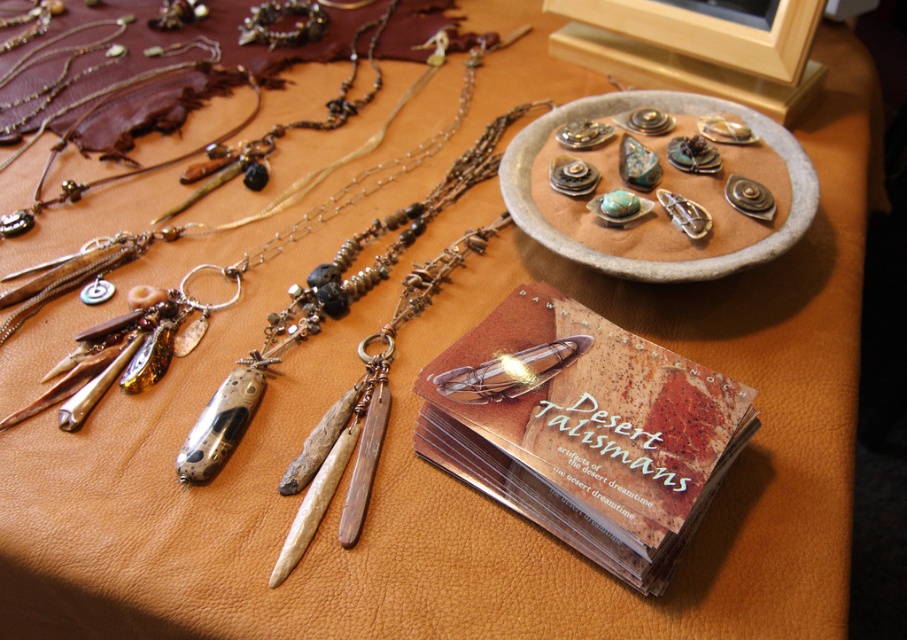
From the picture: You are standing in front of the jewelry display and want to pick up an item. There are two points marked in the image. Which point is closer to you, point (276, 349) or point (680, 131)?

Point (276, 349) is in front of point (680, 131), so it is closer to you.